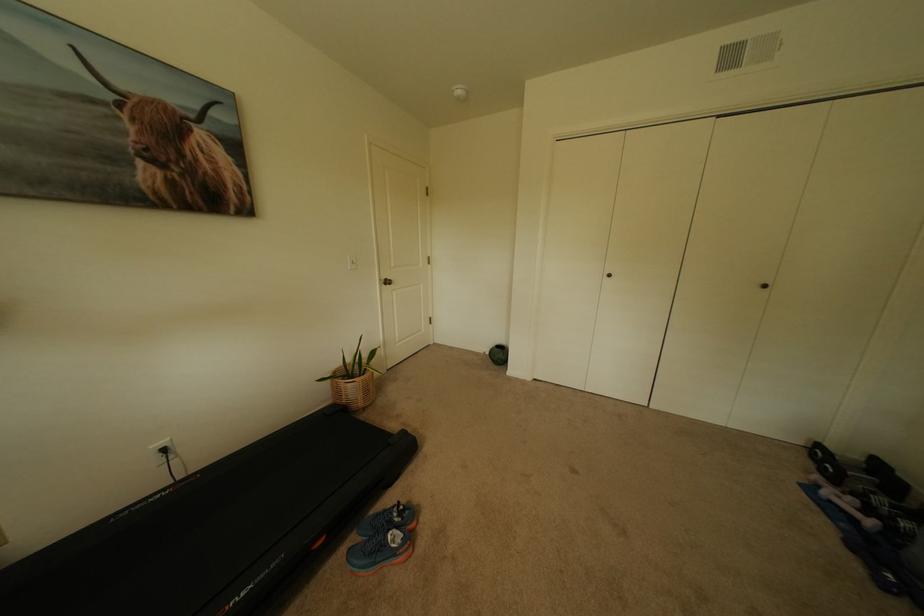
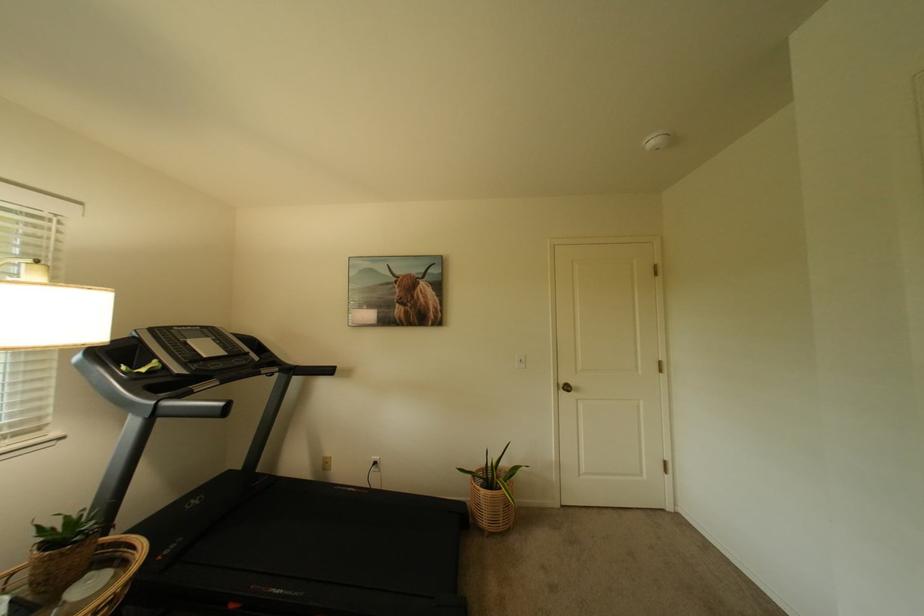
In the second image, find the point that corresponds to pixel 370 395 in the first image.

(495, 515)